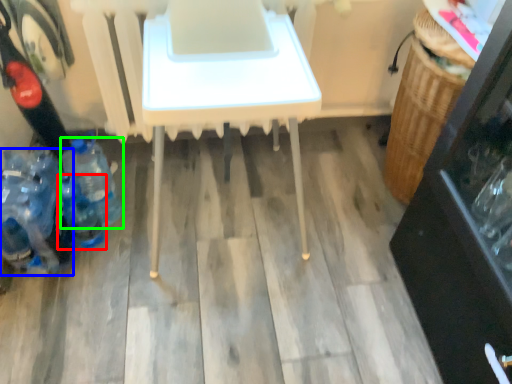
Question: Estimate the real-world distances between objects in this image. Which object is farther from bottle (highlighted by a red box), bottle (highlighted by a blue box) or bottle (highlighted by a green box)?

Choices:
 (A) bottle
 (B) bottle

Answer: (B)